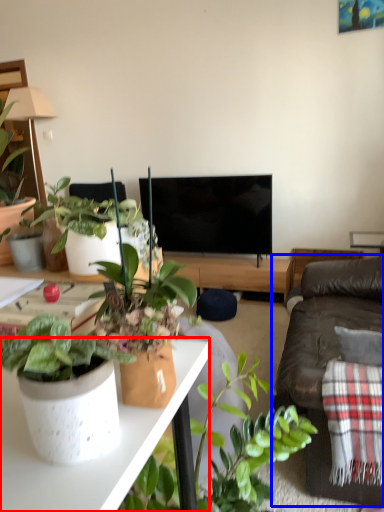
Question: Which point is closer to the camera, desk (highlighted by a red box) or studio couch (highlighted by a blue box)?

Choices:
 (A) desk
 (B) studio couch

Answer: (A)